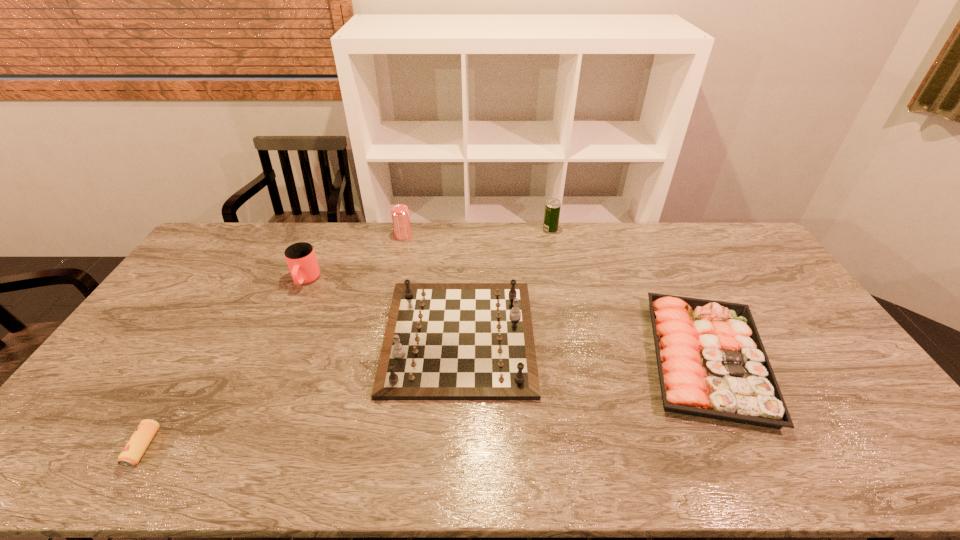
Image resolution: width=960 pixels, height=540 pixels. Identify the location of the closest beer can to the shortest object. (400, 213).

Point out which beer can is positioned as the nearest to the shortest beer can. Please provide its 2D coordinates. Your answer should be formatted as a tuple, i.e. [(x, y)], where the tuple contains the x and y coordinates of a point satisfying the conditions above.

[(400, 213)]

What are the coordinates of `free space that satisfies the following two spatial constraints: 1. on the board of the third shortest object; 2. on the front side of the shortest object` in the screenshot? It's located at (454, 447).

Locate an element on the screen. vacant space that satisfies the following two spatial constraints: 1. on the handle side of the cup; 2. on the right side of the platter is located at coordinates (271, 359).

Identify the location of vacant space that satisfies the following two spatial constraints: 1. on the front side of the second object from right to left; 2. on the board of the chessboard. This screenshot has height=540, width=960. (572, 337).